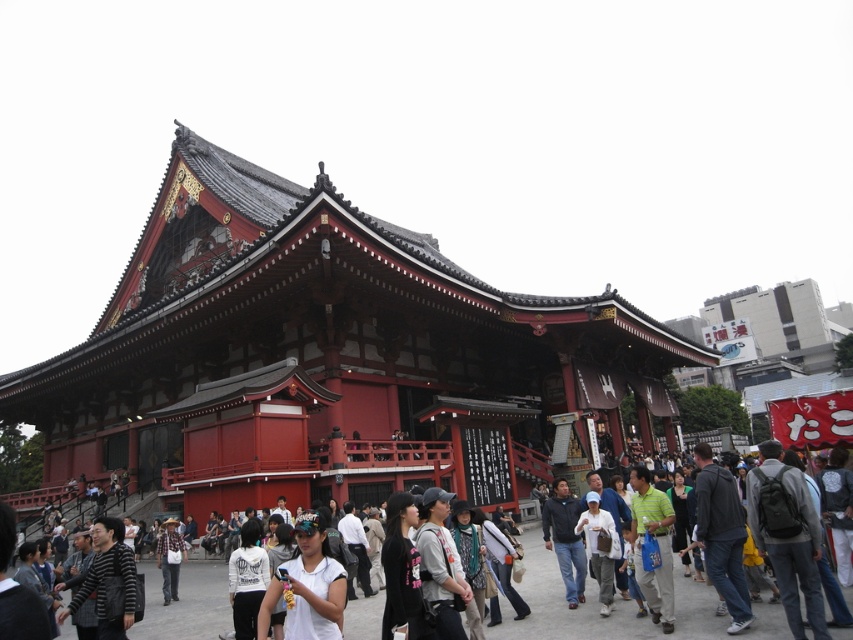
Question: Which point is closer to the camera taking this photo?

Choices:
 (A) (311, 396)
 (B) (659, 616)

Answer: (B)

Question: Among these objects, which one is nearest to the camera?

Choices:
 (A) green matte shirt at center
 (B) black matte shirt at center
 (C) plaid shirt at center
 (D) shiny red temple at center

Answer: (B)

Question: Is gray fabric backpack at center wider than green matte shirt at center?

Choices:
 (A) no
 (B) yes

Answer: (B)

Question: Does shiny red temple at center have a smaller size compared to striped sweater at lower left?

Choices:
 (A) no
 (B) yes

Answer: (A)

Question: Does gray fabric backpack at center appear on the right side of green matte shirt at center?

Choices:
 (A) yes
 (B) no

Answer: (B)

Question: Which is farther from the striped sweater at lower left?

Choices:
 (A) gray fabric backpack at center
 (B) white matte shirt at center
 (C) shiny red temple at center
 (D) black matte shirt at center

Answer: (C)